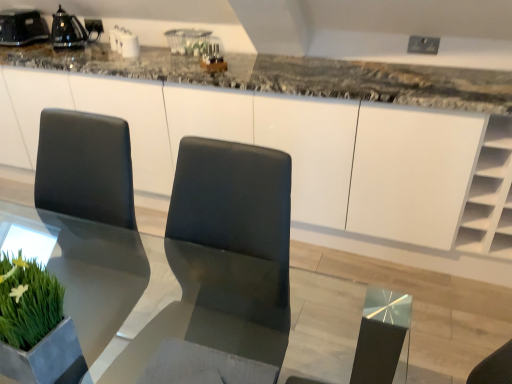
Question: Could you tell me if black glossy kettle at upper left, positioned as the 1th appliance in left-to-right order, is turned towards black glossy kettle at upper left, which is counted as the first appliance, starting from the right?

Choices:
 (A) yes
 (B) no

Answer: (B)

Question: From a real-world perspective, does black glossy kettle at upper left, the 2th appliance in the right-to-left sequence, sit lower than black glossy kettle at upper left, which is counted as the first appliance, starting from the right?

Choices:
 (A) no
 (B) yes

Answer: (A)

Question: From the image's perspective, is black glossy kettle at upper left, positioned as the 1th appliance in left-to-right order, located beneath black glossy kettle at upper left, arranged as the 2th appliance when viewed from the left?

Choices:
 (A) no
 (B) yes

Answer: (A)

Question: Does black glossy kettle at upper left, positioned as the 1th appliance in left-to-right order, lie behind black glossy kettle at upper left, which is counted as the first appliance, starting from the right?

Choices:
 (A) no
 (B) yes

Answer: (B)

Question: From the image's perspective, is black glossy kettle at upper left, the 2th appliance in the right-to-left sequence, above black glossy kettle at upper left, arranged as the 2th appliance when viewed from the left?

Choices:
 (A) no
 (B) yes

Answer: (B)

Question: Is black glossy kettle at upper left, positioned as the 1th appliance in left-to-right order, closer to the viewer compared to black glossy kettle at upper left, arranged as the 2th appliance when viewed from the left?

Choices:
 (A) no
 (B) yes

Answer: (A)

Question: Is black glossy kettle at upper left, which is counted as the first appliance, starting from the right, far from green leafy plant at lower left?

Choices:
 (A) no
 (B) yes

Answer: (B)

Question: Is black glossy kettle at upper left, arranged as the 2th appliance when viewed from the left, taller than green leafy plant at lower left?

Choices:
 (A) no
 (B) yes

Answer: (A)

Question: Can you confirm if black glossy kettle at upper left, which is counted as the first appliance, starting from the right, is wider than green leafy plant at lower left?

Choices:
 (A) yes
 (B) no

Answer: (A)

Question: From the image's perspective, is black glossy kettle at upper left, which is counted as the first appliance, starting from the right, on green leafy plant at lower left?

Choices:
 (A) no
 (B) yes

Answer: (B)

Question: Is black glossy kettle at upper left, arranged as the 2th appliance when viewed from the left, turned away from green leafy plant at lower left?

Choices:
 (A) no
 (B) yes

Answer: (A)

Question: Is green leafy plant at lower left completely or partially inside black glossy kettle at upper left, which is counted as the first appliance, starting from the right?

Choices:
 (A) no
 (B) yes

Answer: (A)

Question: Could you tell me if transparent glass table at center is turned towards black glossy kettle at upper left, the 2th appliance in the right-to-left sequence?

Choices:
 (A) no
 (B) yes

Answer: (A)